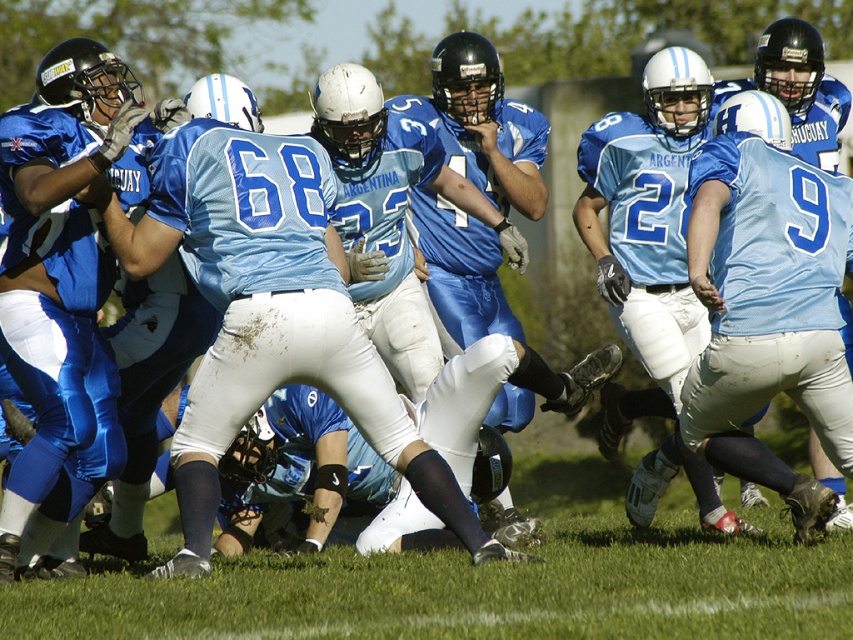
Can you confirm if light blue fabric jersey at center is positioned to the left of matte blue jersey at center?

In fact, light blue fabric jersey at center is to the right of matte blue jersey at center.

Describe the element at coordinates (267, 314) in the screenshot. I see `light blue fabric jersey at center` at that location.

I want to click on light blue fabric jersey at center, so click(267, 314).